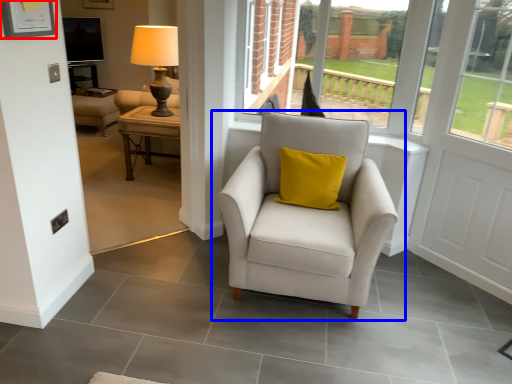
Question: Among these objects, which one is nearest to the camera, picture frame (highlighted by a red box) or chair (highlighted by a blue box)?

Choices:
 (A) picture frame
 (B) chair

Answer: (A)